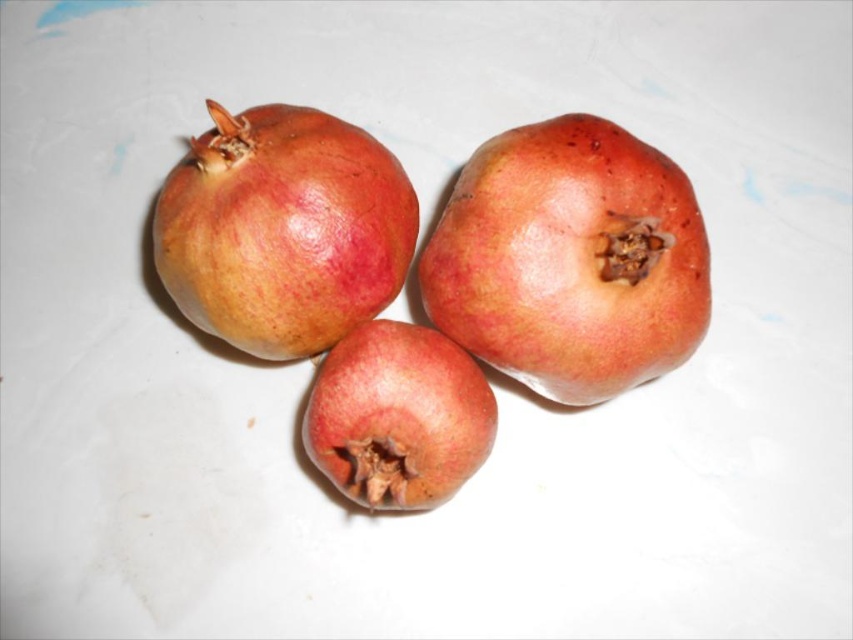
Is point (601, 248) farther from camera compared to point (432, 384)?

No, (601, 248) is in front of (432, 384).

The height and width of the screenshot is (640, 853). In order to click on shiny red pomegranate at center in this screenshot , I will do `click(570, 259)`.

Locate an element on the screen. The height and width of the screenshot is (640, 853). shiny red pomegranate at center is located at coordinates (570, 259).

Is the position of matte red pomegranate at upper left more distant than that of matte red pomegranate at center?

Yes, matte red pomegranate at upper left is further from the viewer.

Who is positioned more to the left, matte red pomegranate at upper left or matte red pomegranate at center?

matte red pomegranate at upper left

The width and height of the screenshot is (853, 640). What do you see at coordinates (282, 228) in the screenshot? I see `matte red pomegranate at upper left` at bounding box center [282, 228].

Identify the location of matte red pomegranate at upper left. coord(282,228).

Based on the photo, is shiny red pomegranate at center thinner than matte red pomegranate at upper left?

No, shiny red pomegranate at center is not thinner than matte red pomegranate at upper left.

Who is positioned more to the left, shiny red pomegranate at center or matte red pomegranate at upper left?

matte red pomegranate at upper left

Image resolution: width=853 pixels, height=640 pixels. In order to click on shiny red pomegranate at center in this screenshot , I will do `click(570, 259)`.